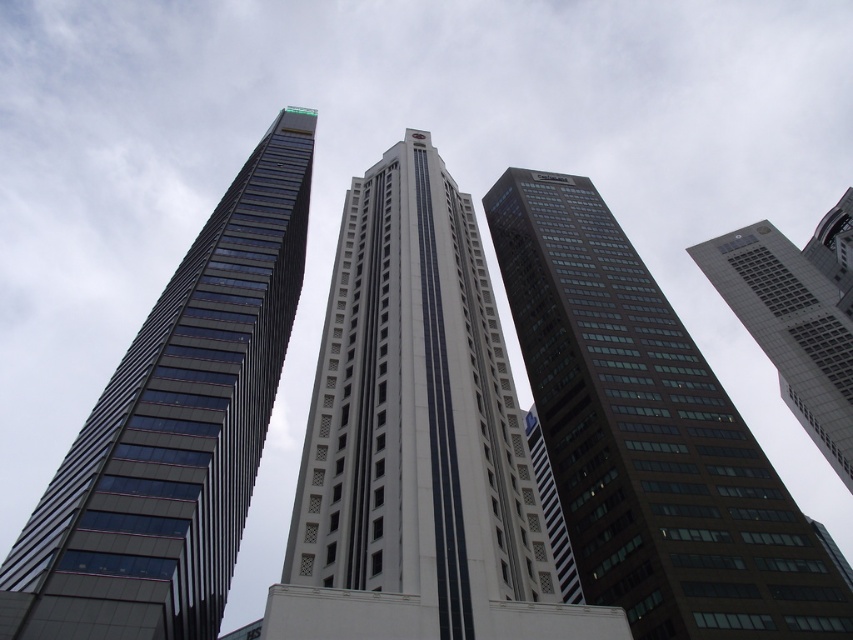
Question: Which of these objects is positioned farthest from the glassy reflective skyscraper at left?

Choices:
 (A) dark brown glass skyscraper at upper right
 (B) brown glass building at center
 (C) glassy reflective skyscraper at center

Answer: (A)

Question: Which object is farther from the camera taking this photo?

Choices:
 (A) brown glass building at center
 (B) dark brown glass skyscraper at upper right
 (C) glassy reflective skyscraper at center

Answer: (B)

Question: Is brown glass building at center wider than glassy reflective skyscraper at left?

Choices:
 (A) no
 (B) yes

Answer: (B)

Question: From the image, what is the correct spatial relationship of glassy reflective skyscraper at center in relation to glassy reflective skyscraper at left?

Choices:
 (A) above
 (B) below

Answer: (A)

Question: Among these objects, which one is nearest to the camera?

Choices:
 (A) glassy reflective skyscraper at center
 (B) glassy reflective skyscraper at left
 (C) brown glass building at center
 (D) dark brown glass skyscraper at upper right

Answer: (A)

Question: Does brown glass building at center appear on the right side of glassy reflective skyscraper at left?

Choices:
 (A) yes
 (B) no

Answer: (A)